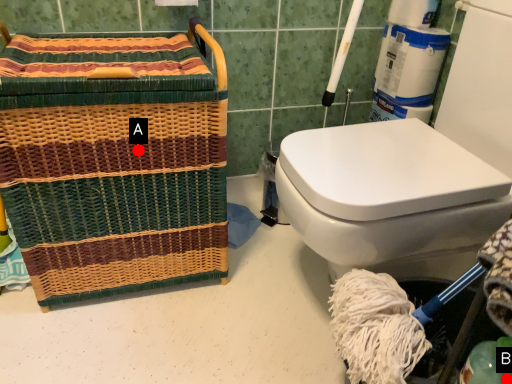
Question: Two points are circled on the image, labeled by A and B beside each circle. Which point is farther from the camera taking this photo?

Choices:
 (A) A is further
 (B) B is further

Answer: (A)